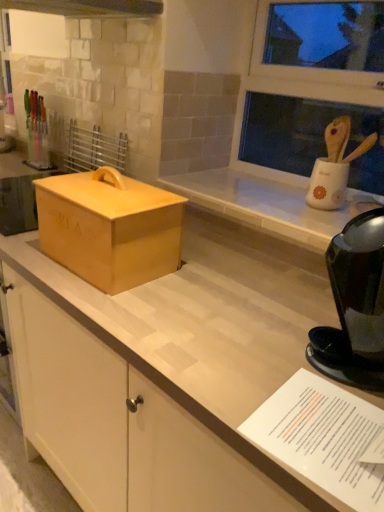
The width and height of the screenshot is (384, 512). Identify the location of free space above white paper at lower right (from a real-world perspective). (337, 422).